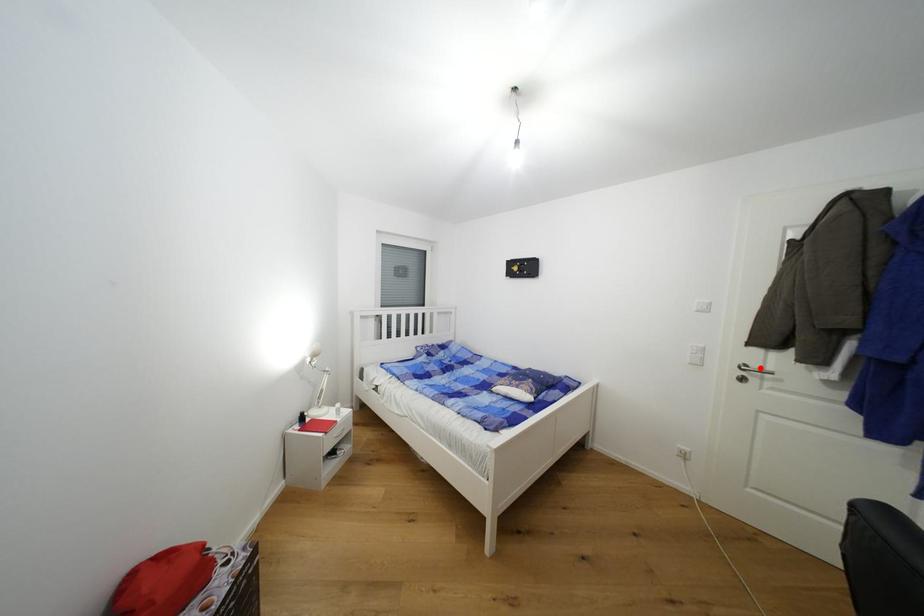
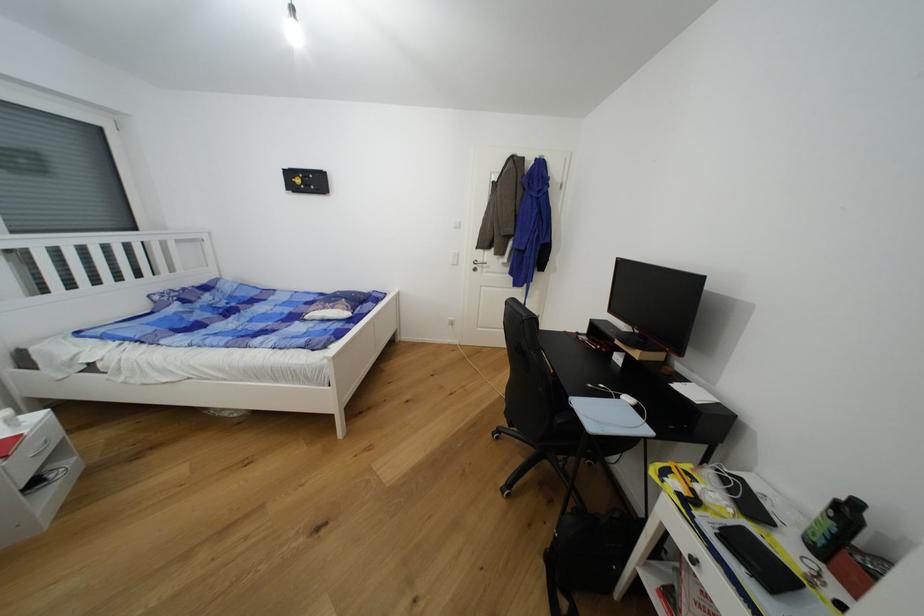
Question: I am providing you with two images of the same scene from different viewpoints. Image1 has a red point marked. In image2, the corresponding 3D location appears at what relative position? Reply with the corresponding letter.

Choices:
 (A) Closer
 (B) Farther

Answer: (A)